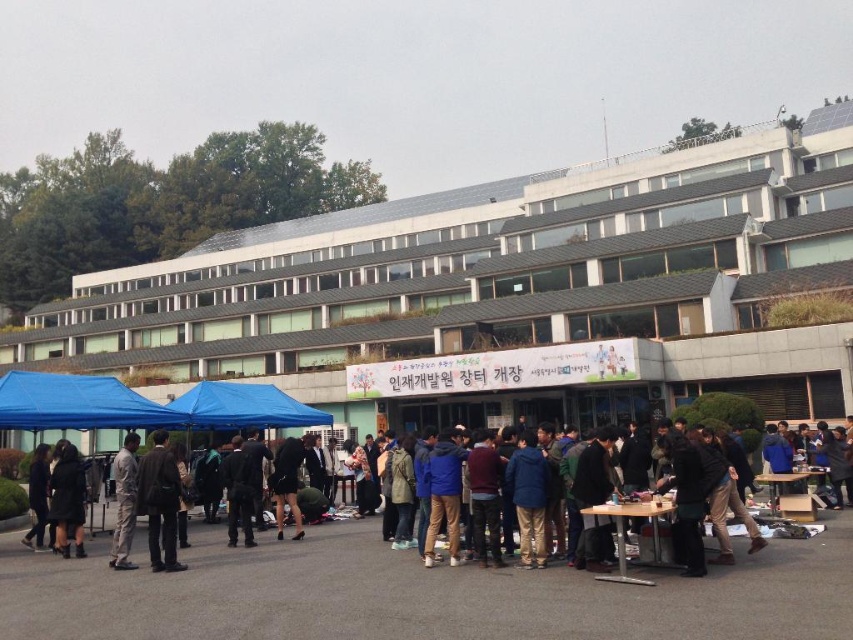
Who is more distant from viewer, [0,387] or [152,465]?

The point [0,387] is behind.

Where is `blue fabric canopy at lower left`? blue fabric canopy at lower left is located at coordinates (77, 403).

Where is `blue fabric canopy at lower left`? The height and width of the screenshot is (640, 853). blue fabric canopy at lower left is located at coordinates click(77, 403).

Does black matte coat at lower left have a lesser width compared to light gray fabric pants at lower left?

Yes.

Is point (59, 529) less distant than point (129, 497)?

No.

In order to click on black matte coat at lower left in this screenshot , I will do pos(67,500).

Is black fabric jacket at center further to camera compared to dark blue fabric coat at lower left?

No, it is not.

Is black fabric jacket at center to the left of dark blue fabric coat at lower left from the viewer's perspective?

Incorrect, black fabric jacket at center is not on the left side of dark blue fabric coat at lower left.

Is point (244, 515) farther from viewer compared to point (28, 484)?

No, (244, 515) is in front of (28, 484).

At what (x,y) coordinates should I click in order to perform the action: click on black fabric jacket at center. Please return your answer as a coordinate pair (x, y). The image size is (853, 640). Looking at the image, I should click on (239, 490).